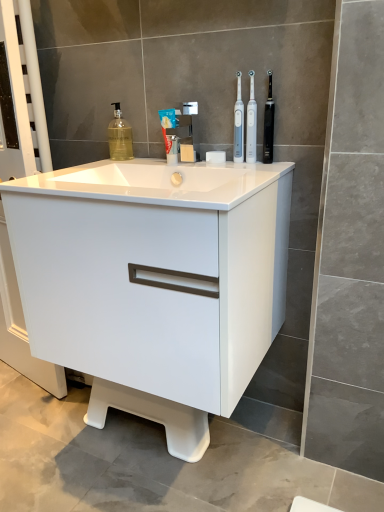
The width and height of the screenshot is (384, 512). Find the location of `vacant area that lies between black plastic toothbrush at upper right, the 1th toothbrush in the right-to-left sequence, and chrome metallic faucet at upper center`. vacant area that lies between black plastic toothbrush at upper right, the 1th toothbrush in the right-to-left sequence, and chrome metallic faucet at upper center is located at coordinates (219, 166).